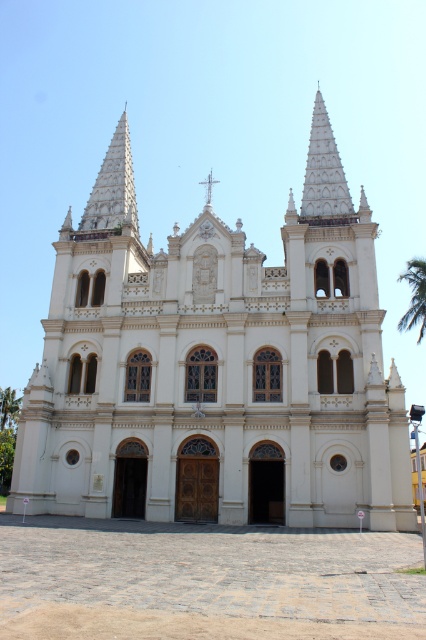
You are standing at the entrance of the grand ornate church and see two points marked on the facade. The first point is at coordinates point (336,179) and the second is at point (212,180). Which point is closer to you as you face the church?

Point (336,179) is in front of point (212,180), so the first point is closer to you.

You are an architect evaluating the proportions of the white stone church at center and the white stucco spire at upper center. Which structure is taller?

The white stone church at center is taller than the white stucco spire at upper center according to the description.

You are standing in front of the white stone church at center and want to look up at the white stucco spire at upper center. Which direction should you move your head to see it?

You should look upwards because the white stucco spire at upper center is positioned above the white stone church at center.